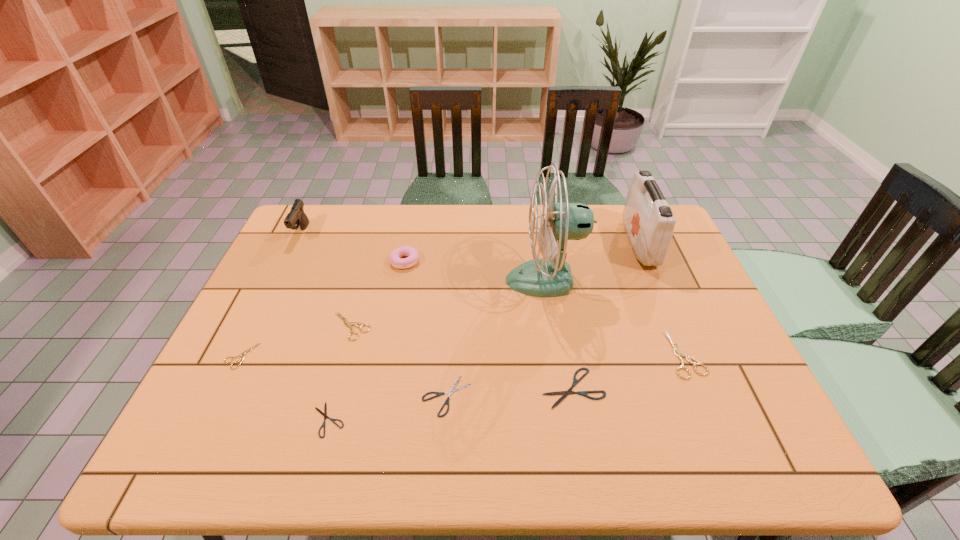
This screenshot has width=960, height=540. Identify the location of shears at the right edge. (679, 354).

Identify the location of object located at the far left corner. This screenshot has width=960, height=540. (296, 217).

Locate an element on the screen. object present at the far right corner is located at coordinates coord(648,220).

Image resolution: width=960 pixels, height=540 pixels. What are the coordinates of `free space at the far edge` in the screenshot? It's located at (510, 225).

This screenshot has width=960, height=540. I want to click on free space at the near edge, so click(313, 441).

Where is `free space at the left edge of the desktop`? Image resolution: width=960 pixels, height=540 pixels. free space at the left edge of the desktop is located at coordinates (275, 279).

In the image, there is a desktop. At what (x,y) coordinates should I click in order to perform the action: click on vacant space at the right edge. Please return your answer as a coordinate pair (x, y). The image size is (960, 540). Looking at the image, I should click on (743, 383).

Find the location of `free space at the far left corner of the desktop`. free space at the far left corner of the desktop is located at coordinates (334, 220).

Identify the location of vacant space at the near right corner of the desktop. (729, 430).

Where is `free space that is in between the smallest black shears and the biggest beige shears`? The height and width of the screenshot is (540, 960). free space that is in between the smallest black shears and the biggest beige shears is located at coordinates (507, 387).